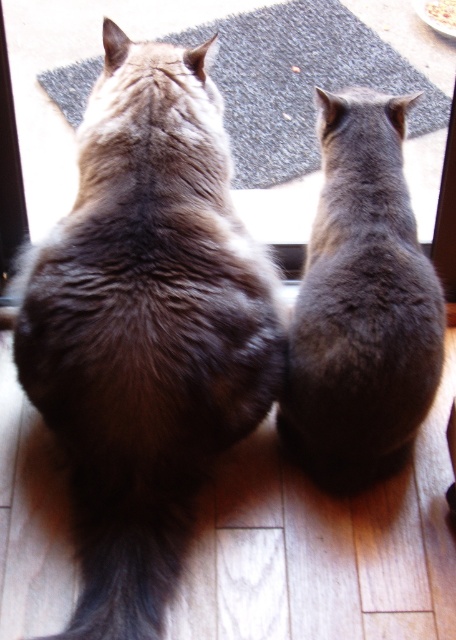
Between point (227, 349) and point (376, 349), which one is positioned in front?

Positioned in front is point (227, 349).

Between point (224, 260) and point (294, 380), which one is positioned behind?

Positioned behind is point (294, 380).

Where is `brown fur cat at upper left`? Image resolution: width=456 pixels, height=640 pixels. brown fur cat at upper left is located at coordinates (145, 324).

Between brown fur cat at upper left and white paper plate at upper center, which one appears on the left side from the viewer's perspective?

brown fur cat at upper left

Locate an element on the screen. The width and height of the screenshot is (456, 640). brown fur cat at upper left is located at coordinates (145, 324).

At what (x,y) coordinates should I click in order to perform the action: click on brown fur cat at upper left. Please return your answer as a coordinate pair (x, y). The width and height of the screenshot is (456, 640). Looking at the image, I should click on (145, 324).

Does gray fur cat at center have a greater height compared to white paper plate at upper center?

Yes, gray fur cat at center is taller than white paper plate at upper center.

Between gray fur cat at center and white paper plate at upper center, which one is positioned lower?

gray fur cat at center

Between point (374, 262) and point (452, 10), which one is positioned behind?

The point (452, 10) is behind.

Find the location of a particular element. gray fur cat at center is located at coordinates coord(362,304).